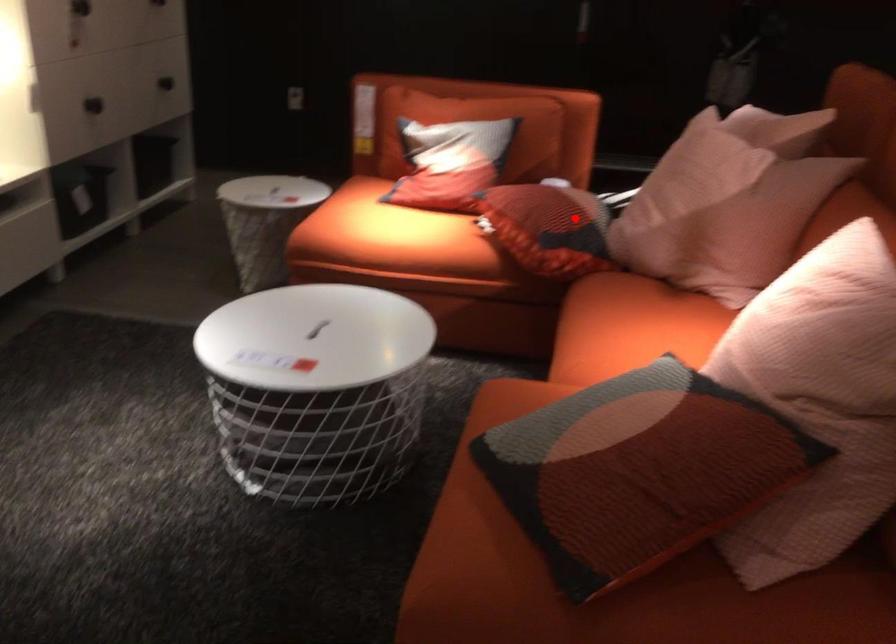
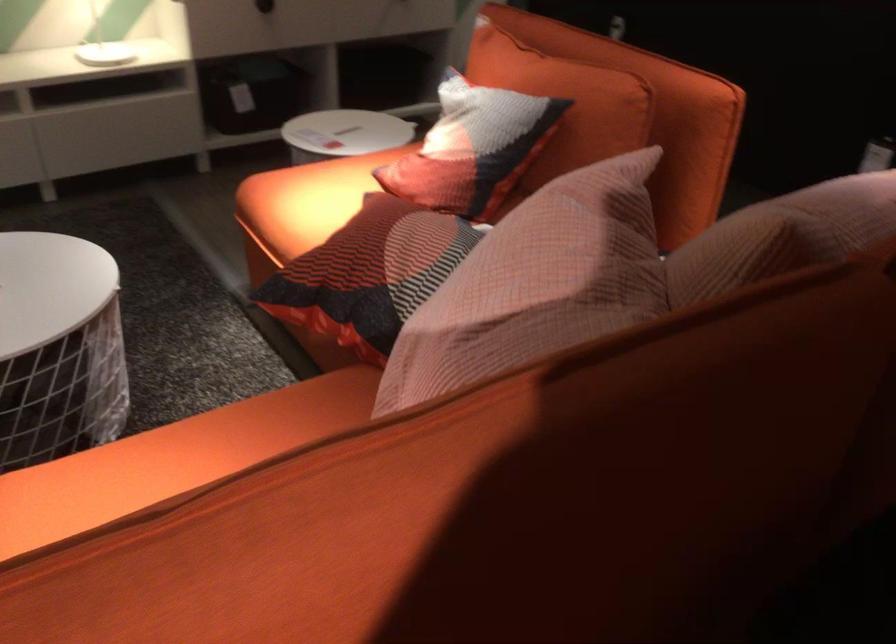
Where in the second image is the point corresponding to the highlighted location from the first image?

(369, 274)